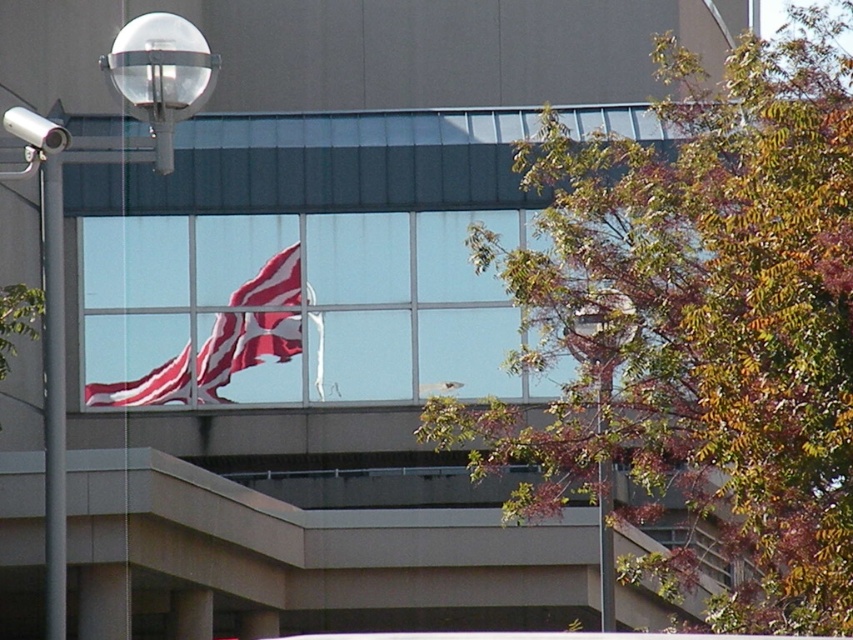
Does red/white striped fabric at center appear on the left side of metallic glass lamp post at upper center?

Correct, you'll find red/white striped fabric at center to the left of metallic glass lamp post at upper center.

Is red/white striped fabric at center smaller than metallic glass lamp post at upper center?

No, red/white striped fabric at center is not smaller than metallic glass lamp post at upper center.

Identify the location of red/white striped fabric at center. The width and height of the screenshot is (853, 640). (207, 362).

Identify the location of red/white striped fabric at center. (207, 362).

Can you confirm if metallic glass globe at upper left is taller than red/white striped fabric at center?

Indeed, metallic glass globe at upper left has a greater height compared to red/white striped fabric at center.

What do you see at coordinates (62, 212) in the screenshot?
I see `metallic glass globe at upper left` at bounding box center [62, 212].

At what (x,y) coordinates should I click in order to perform the action: click on metallic glass globe at upper left. Please return your answer as a coordinate pair (x, y). Image resolution: width=853 pixels, height=640 pixels. Looking at the image, I should click on (62, 212).

Can you confirm if metallic glass globe at upper left is wider than metallic glass lamp post at upper center?

Correct, the width of metallic glass globe at upper left exceeds that of metallic glass lamp post at upper center.

Which is more to the left, metallic glass globe at upper left or metallic glass lamp post at upper center?

metallic glass globe at upper left is more to the left.

The height and width of the screenshot is (640, 853). Describe the element at coordinates (62, 212) in the screenshot. I see `metallic glass globe at upper left` at that location.

Where is `metallic glass globe at upper left`? This screenshot has width=853, height=640. metallic glass globe at upper left is located at coordinates (62, 212).